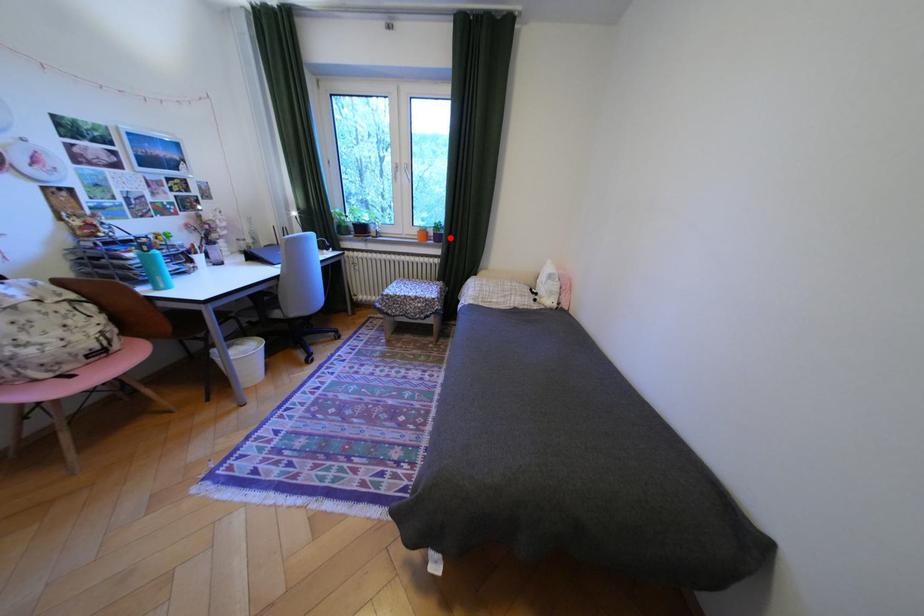
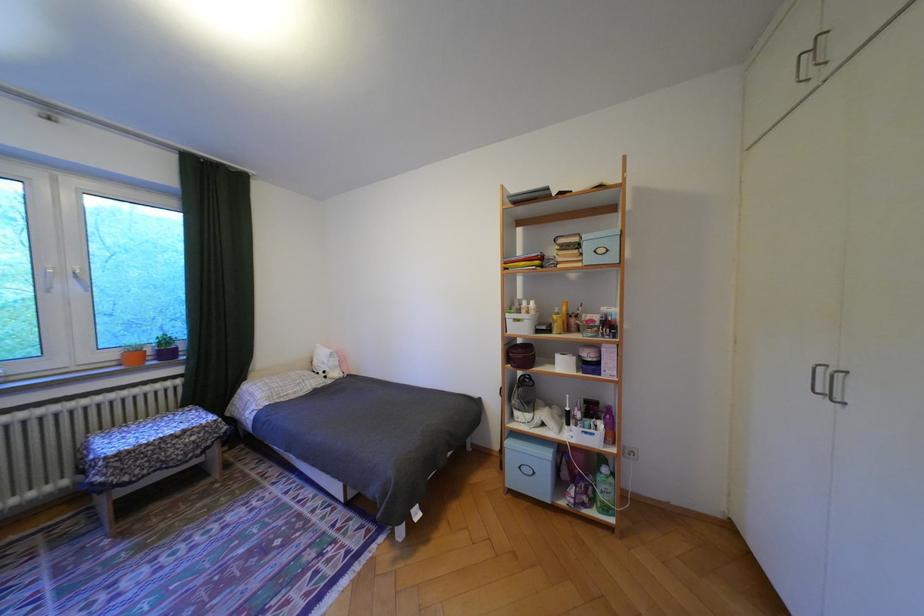
Question: I am providing you with two images of the same scene from different viewpoints. In image1, a red point is highlighted. Considering the same 3D point in image2, which of the following is correct?

Choices:
 (A) It is closer
 (B) It is farther

Answer: (B)